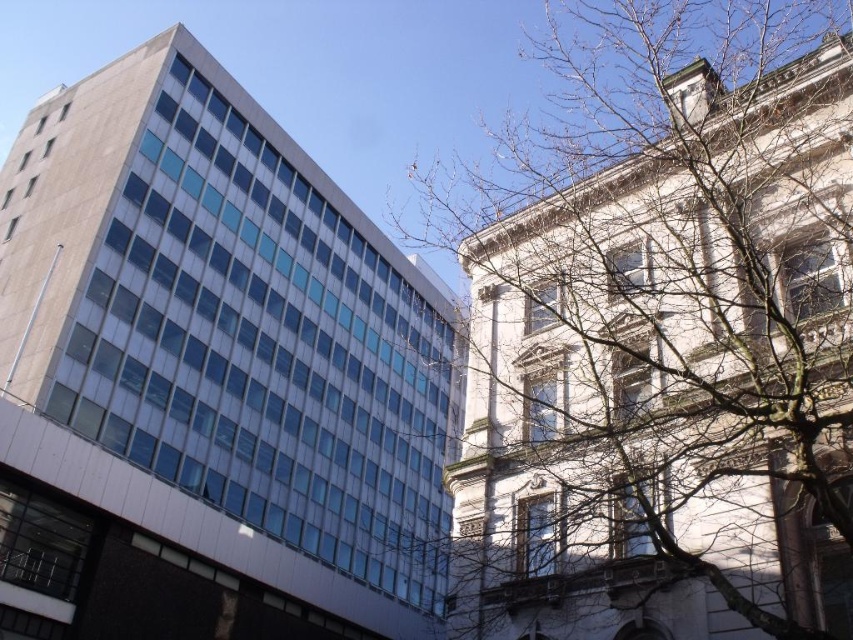
What are the coordinates of the bare branches at upper right in the image?

The coordinates of the bare branches at upper right are at point (660, 332).

You are standing in a park and see the bare branches at upper right and the matte glass building at left. Which object is higher in the scene?

The bare branches at upper right are higher than the matte glass building at left because the description states that the bare branches at upper right is above matte glass building at left.

You are an architect analyzing the image. You need to determine if the bare branches at upper right are obscuring the view of the matte glass building at left from your current vantage point. Based on the scene, what can you conclude?

The bare branches at upper right are in front of the matte glass building at left, so they are obscuring the view of the matte glass building at left from your current vantage point.